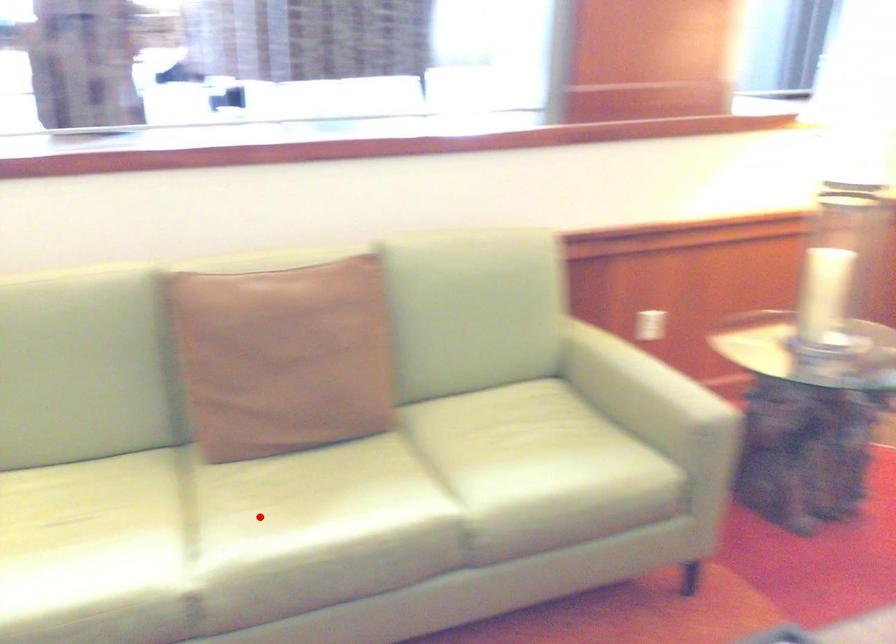
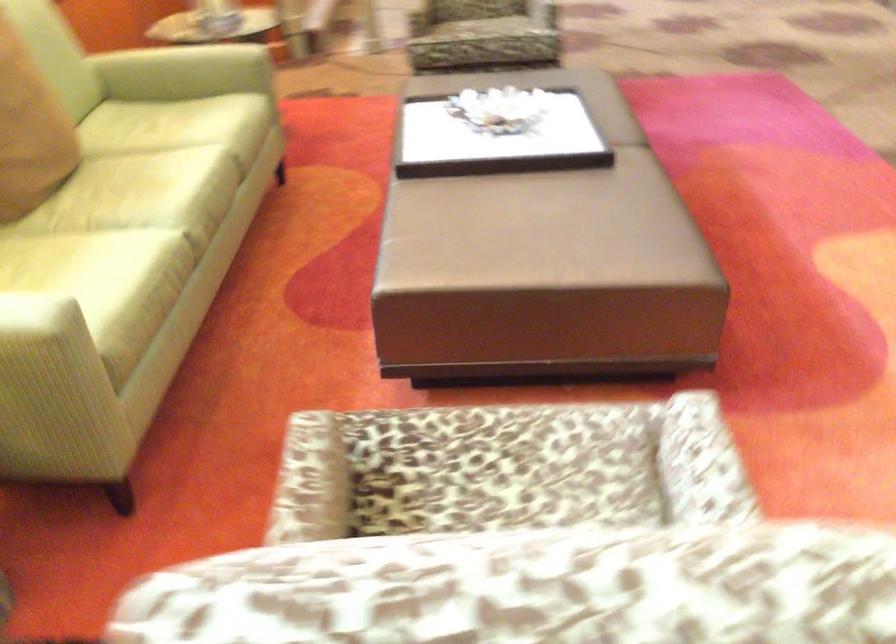
Question: I am providing you with two images of the same scene from different viewpoints. A red point is shown in image1. For the corresponding object point in image2, is it positioned nearer or farther from the camera?

Choices:
 (A) Nearer
 (B) Farther

Answer: (B)